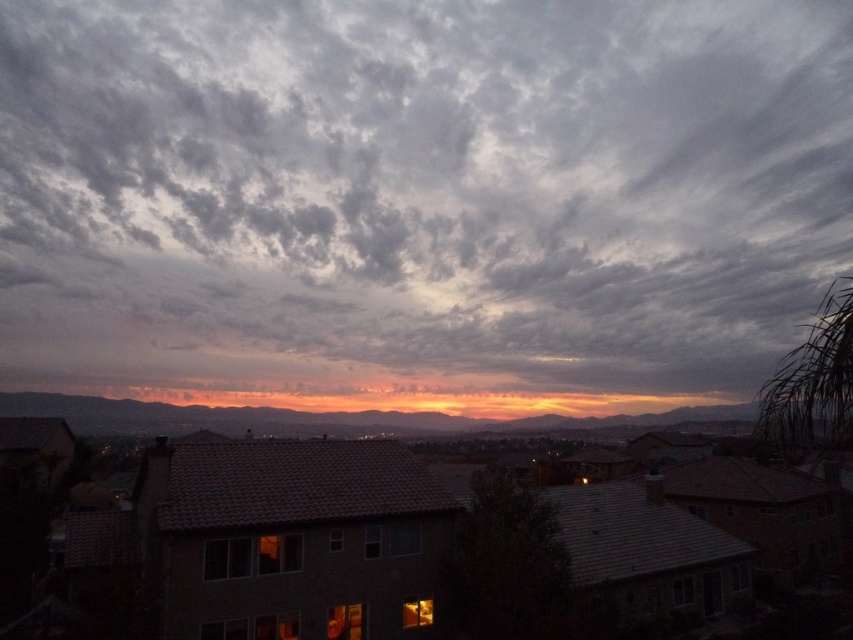
Question: Is cloudy sky at upper center below orange sky at center?

Choices:
 (A) no
 (B) yes

Answer: (A)

Question: In this image, where is cloudy sky at upper center located relative to orange sky at center?

Choices:
 (A) above
 (B) below

Answer: (A)

Question: Which object is closer to the camera taking this photo?

Choices:
 (A) cloudy sky at upper center
 (B) orange sky at center

Answer: (B)

Question: Can you confirm if cloudy sky at upper center is positioned to the left of orange sky at center?

Choices:
 (A) yes
 (B) no

Answer: (B)